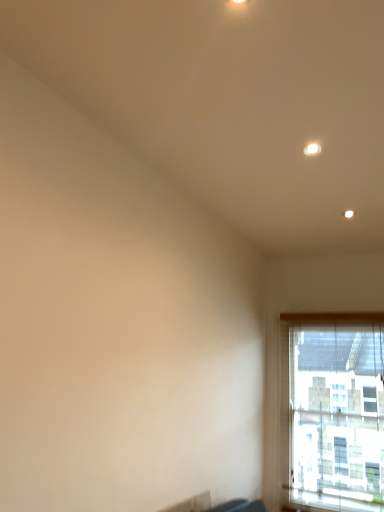
Where is `transparent glass window at lower right`? This screenshot has height=512, width=384. transparent glass window at lower right is located at coordinates (332, 411).

Describe the element at coordinates (332, 411) in the screenshot. This screenshot has height=512, width=384. I see `transparent glass window at lower right` at that location.

The width and height of the screenshot is (384, 512). Identify the location of transparent glass window at lower right. (332, 411).